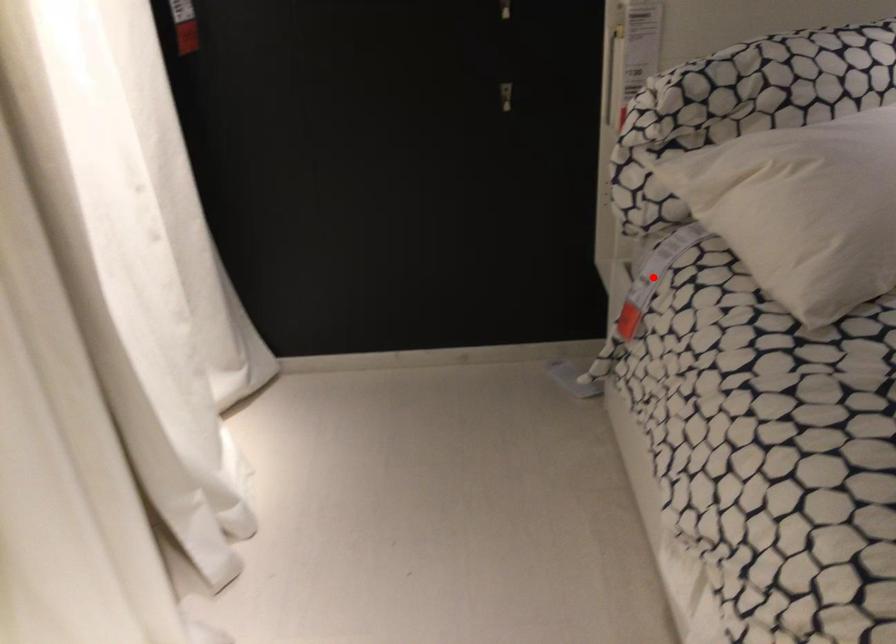
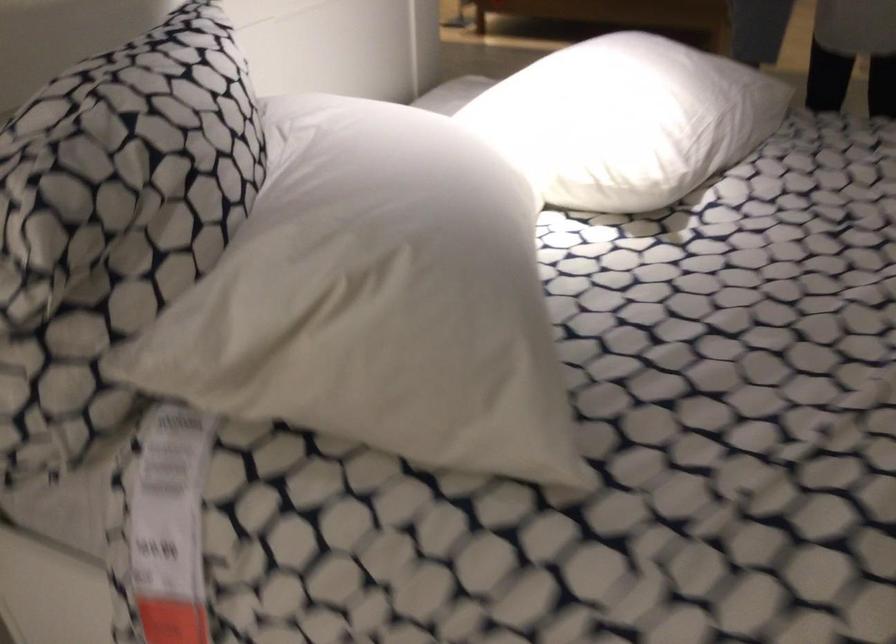
Find the pixel in the second image that matches the highlighted location in the first image.

(169, 526)